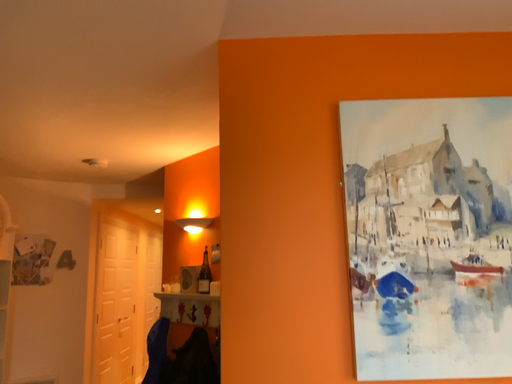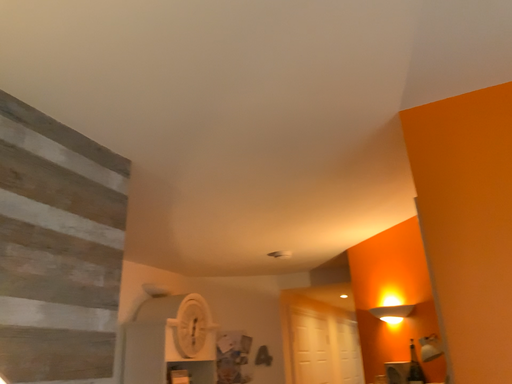
Question: Which way did the camera rotate in the video?

Choices:
 (A) rotated upward
 (B) rotated downward

Answer: (A)